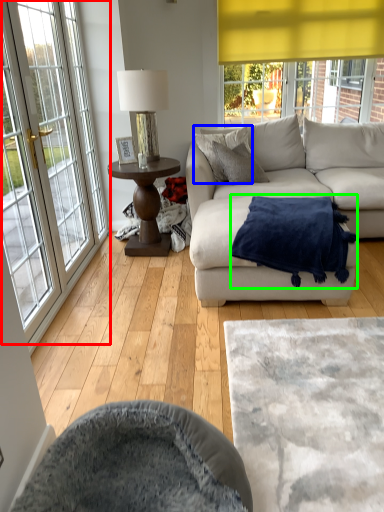
Question: Which object is the closest to the window (highlighted by a red box)? Choose among these: pillow (highlighted by a blue box) or blanket (highlighted by a green box).

Choices:
 (A) pillow
 (B) blanket

Answer: (A)